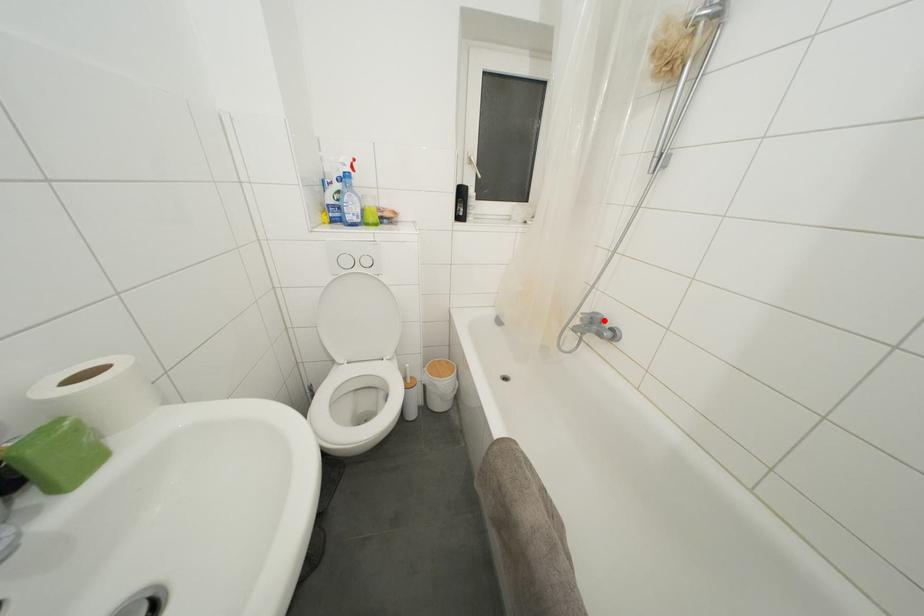
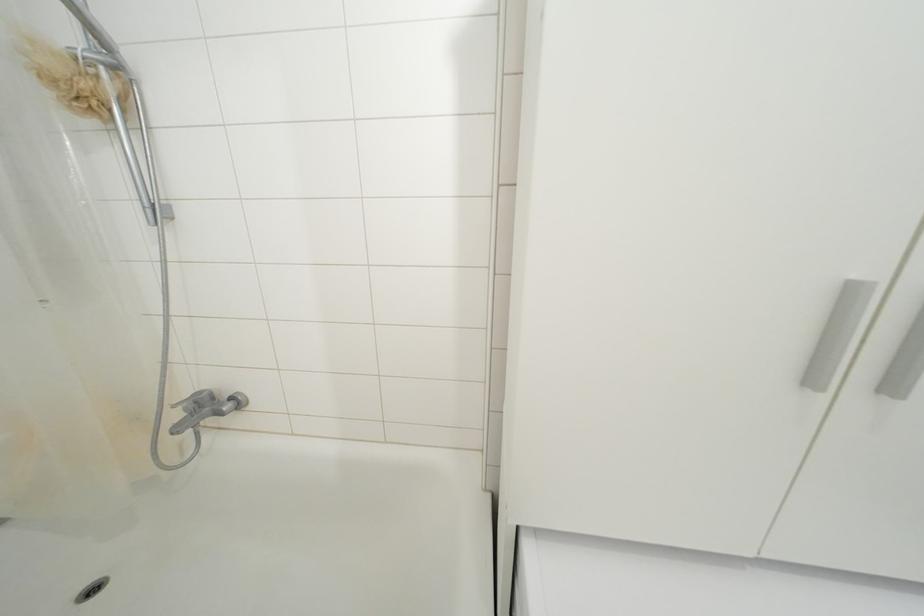
In the second image, find the point that corresponds to the highlighted location in the first image.

(209, 398)